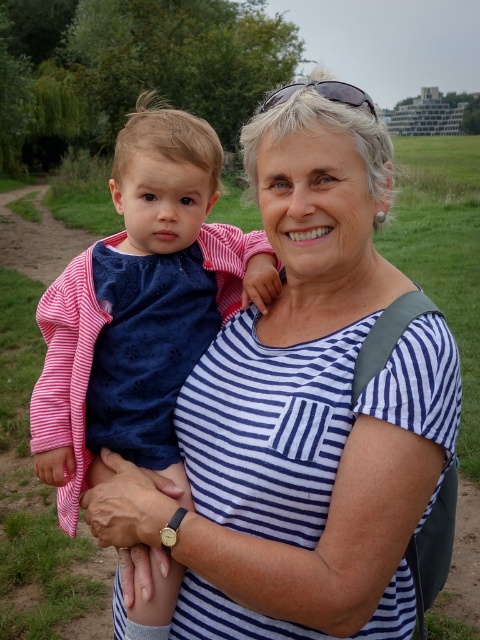
Question: Is white striped shirt at center smaller than matte blue dress at center?

Choices:
 (A) no
 (B) yes

Answer: (A)

Question: Which of the following is the farthest from the observer?

Choices:
 (A) white striped shirt at center
 (B) matte blue dress at center

Answer: (B)

Question: Which point is farther from the camera taking this photo?

Choices:
 (A) (336, 100)
 (B) (155, 397)

Answer: (B)

Question: Does white striped shirt at center have a lesser width compared to matte blue dress at center?

Choices:
 (A) no
 (B) yes

Answer: (A)

Question: Does white striped shirt at center appear over matte blue dress at center?

Choices:
 (A) yes
 (B) no

Answer: (B)